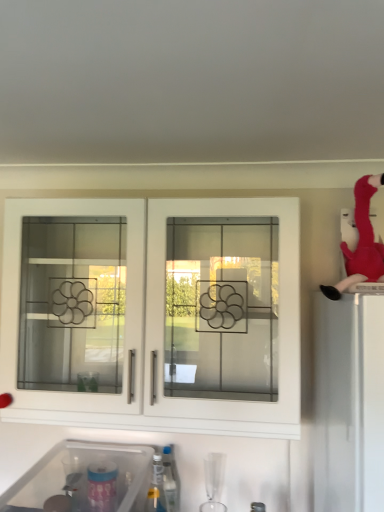
Question: Is translucent plastic bottle at lower center wider than transparent plastic sink at lower left?

Choices:
 (A) no
 (B) yes

Answer: (A)

Question: Could transparent plastic sink at lower left be considered to be inside translucent plastic bottle at lower center?

Choices:
 (A) no
 (B) yes

Answer: (A)

Question: From a real-world perspective, is translucent plastic bottle at lower center physically below transparent plastic sink at lower left?

Choices:
 (A) no
 (B) yes

Answer: (B)

Question: Is translucent plastic bottle at lower center smaller than transparent plastic sink at lower left?

Choices:
 (A) no
 (B) yes

Answer: (B)

Question: Are translucent plastic bottle at lower center and transparent plastic sink at lower left far apart?

Choices:
 (A) yes
 (B) no

Answer: (B)

Question: In terms of width, does white glass cabinet doors at center look wider or thinner when compared to velvet plush flamingo at upper right?

Choices:
 (A) wide
 (B) thin

Answer: (A)

Question: Looking at the image, does white glass cabinet doors at center seem bigger or smaller compared to velvet plush flamingo at upper right?

Choices:
 (A) big
 (B) small

Answer: (A)

Question: Is point (297, 305) closer or farther from the camera than point (362, 219)?

Choices:
 (A) farther
 (B) closer

Answer: (B)

Question: In the image, is white glass cabinet doors at center on the left side or the right side of velvet plush flamingo at upper right?

Choices:
 (A) right
 (B) left

Answer: (B)

Question: Based on their sizes in the image, would you say velvet plush flamingo at upper right is bigger or smaller than translucent plastic bottle at lower center?

Choices:
 (A) small
 (B) big

Answer: (B)

Question: From a real-world perspective, is velvet plush flamingo at upper right physically located above or below translucent plastic bottle at lower center?

Choices:
 (A) above
 (B) below

Answer: (A)

Question: Is velvet plush flamingo at upper right taller or shorter than translucent plastic bottle at lower center?

Choices:
 (A) tall
 (B) short

Answer: (A)

Question: Considering the positions of velvet plush flamingo at upper right and translucent plastic bottle at lower center in the image, is velvet plush flamingo at upper right wider or thinner than translucent plastic bottle at lower center?

Choices:
 (A) wide
 (B) thin

Answer: (A)

Question: In the image, is transparent plastic sink at lower left positioned in front of or behind white glass cabinet doors at center?

Choices:
 (A) behind
 (B) front

Answer: (B)

Question: Considering the relative positions of transparent plastic sink at lower left and white glass cabinet doors at center in the image provided, is transparent plastic sink at lower left to the left or to the right of white glass cabinet doors at center?

Choices:
 (A) right
 (B) left

Answer: (B)